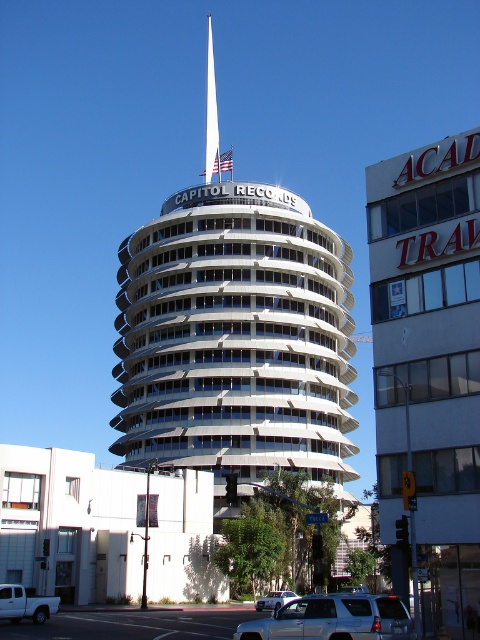
Does white matte truck at lower left have a lesser height compared to white glossy spire at center?

Indeed, white matte truck at lower left has a lesser height compared to white glossy spire at center.

Can you confirm if white matte truck at lower left is smaller than white glossy spire at center?

Yes, white matte truck at lower left is smaller than white glossy spire at center.

Locate an element on the screen. This screenshot has width=480, height=640. white matte truck at lower left is located at coordinates (24, 604).

Can you confirm if white matte truck at lower left is thinner than silver metallic suv at center?

Indeed, white matte truck at lower left has a lesser width compared to silver metallic suv at center.

Which is above, white matte truck at lower left or silver metallic suv at center?

white matte truck at lower left is higher up.

Is point (3, 589) positioned after point (265, 595)?

No, it is in front of (265, 595).

What are the coordinates of `white matte truck at lower left` in the screenshot? It's located at (24, 604).

Identify the location of silver metallic suv at lower center. Image resolution: width=480 pixels, height=640 pixels. click(x=333, y=620).

Is silver metallic suv at lower center smaller than silver metallic suv at center?

No, silver metallic suv at lower center is not smaller than silver metallic suv at center.

Between point (313, 632) and point (284, 600), which one is positioned in front?

Point (313, 632) is more forward.

At what (x,y) coordinates should I click in order to perform the action: click on silver metallic suv at lower center. Please return your answer as a coordinate pair (x, y). The height and width of the screenshot is (640, 480). Looking at the image, I should click on (333, 620).